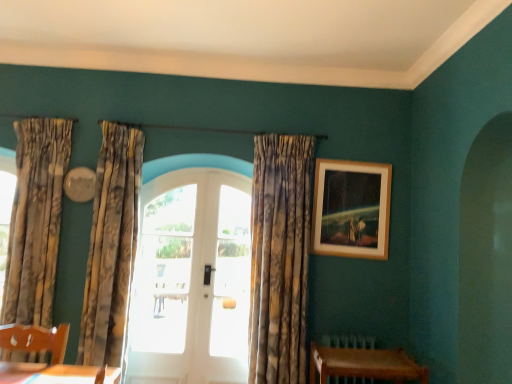
What are the coordinates of `empty space that is ontop of white glass door at center, the second window viewed from the left (from a real-world perspective)` in the screenshot? It's located at (224, 169).